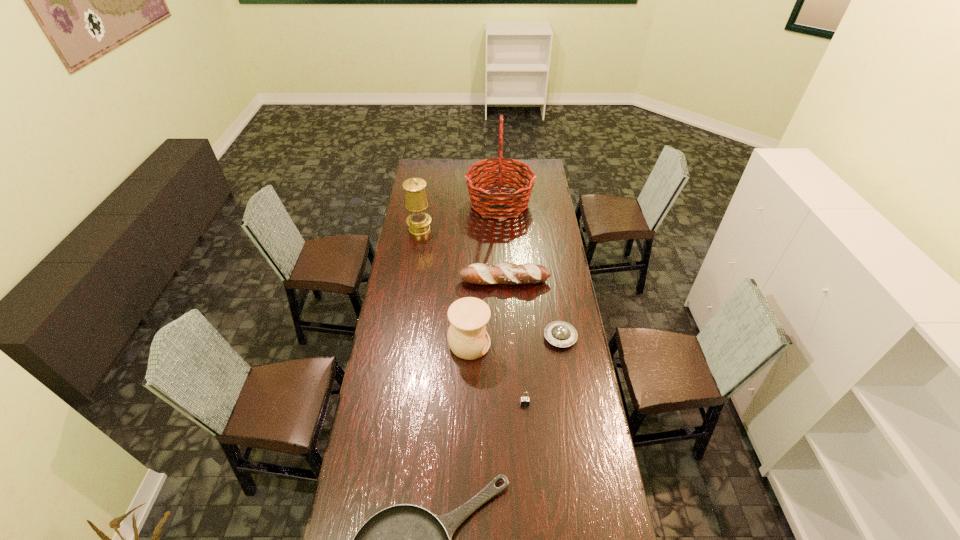
Where is `free space that satisfies the following two spatial constraints: 1. on the front side of the basket; 2. on the right side of the saucer`? free space that satisfies the following two spatial constraints: 1. on the front side of the basket; 2. on the right side of the saucer is located at coordinates (507, 338).